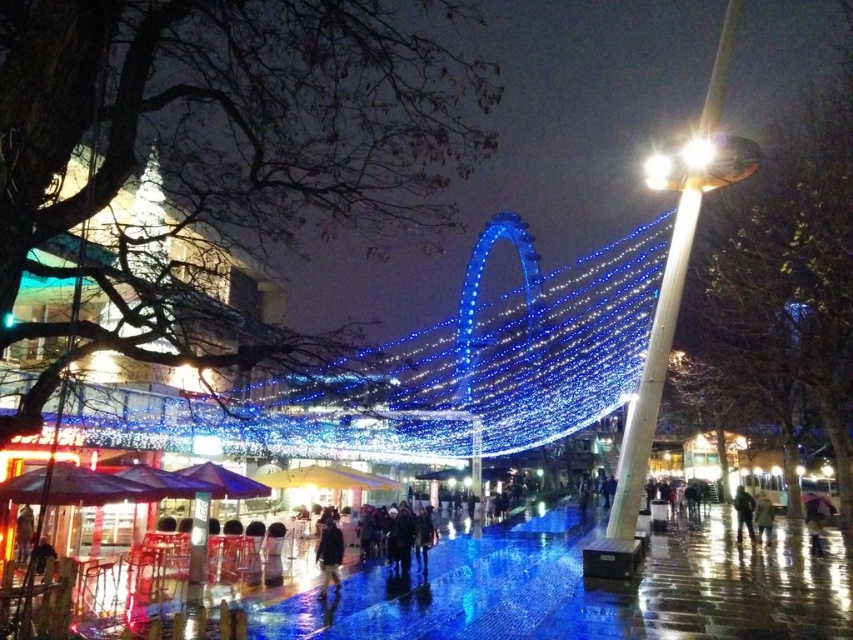
From the picture: You are standing in the middle of the wet pavement and see two points marked on the ground. The first point is at coordinates point [699,540] and the second is at point [321,570]. Which point is closer to your current position?

Neither point is closer because their positions depend on your exact location. However, point [321,570] is closer to the bottom of the image, while point [699,540] is closer to the top.